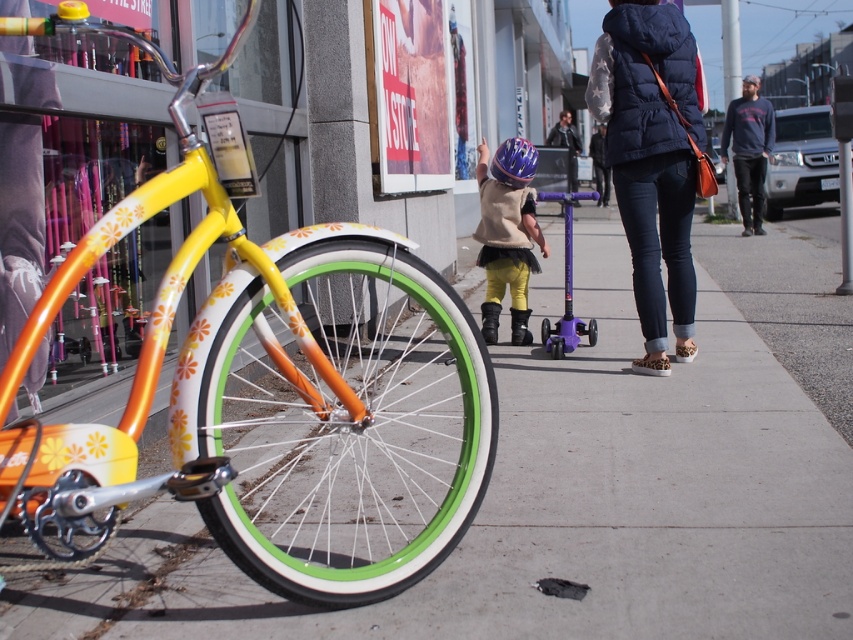
You are standing at the center of the image and want to reach the floral painted bicycle at left. Which direction should you move in to get there?

The floral painted bicycle at left is located at point (276, 392), so you should move to the left and slightly forward to reach it.

You are a delivery person who needs to pick up a package from the dark blue puffer vest at center. The floral painted bicycle at left is blocking the path. Can you move the bicycle to access the package?

The floral painted bicycle at left is located below the dark blue puffer vest at center, so moving the bicycle would allow access to the package at the center.

You are a delivery person carrying a package that requires a 2 meter distance for safe landing. You see the floral painted bicycle at left and the purple scooter in the midground. Can you safely place your package between them?

The distance between the floral painted bicycle at left and the purple scooter in the midground is 1.59 meters, which is less than the required 2 meters. Therefore, you cannot safely place your package between them.